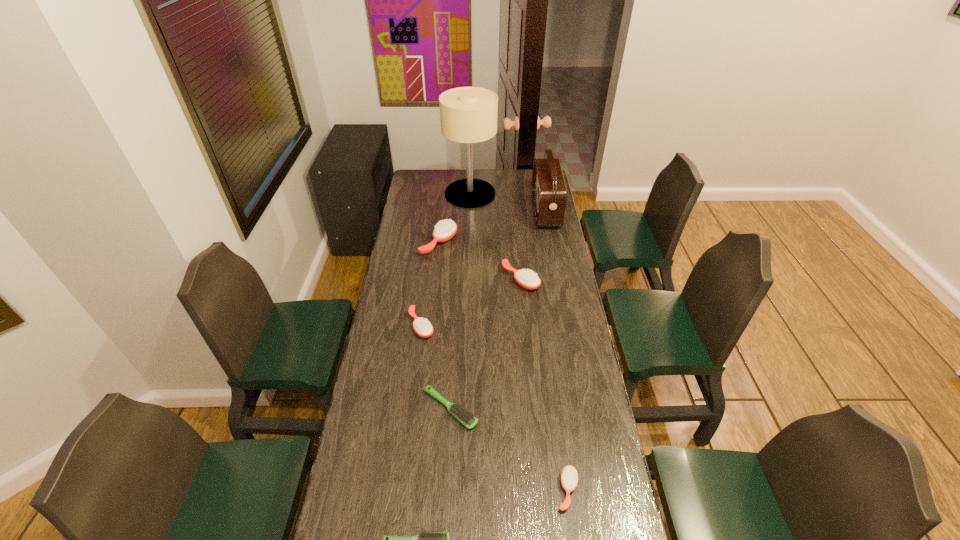
Select which light hairbrush is the second closest to the seventh shortest object. Please provide its 2D coordinates. Your answer should be formatted as a tuple, i.e. [(x, y)], where the tuple contains the x and y coordinates of a point satisfying the conditions above.

[(433, 539)]

Locate an element on the screen. the closest light hairbrush to the third nearest orange hairbrush is located at coordinates (461, 414).

You are a GUI agent. You are given a task and a screenshot of the screen. Output one action in this format:
    pyautogui.click(x=<x>, y=<y>)
    Task: Click on the vacant area in the image that satisfies the following two spatial constraints: 1. on the back side of the biggest orange hairbrush; 2. on the left side of the fourth shortest hairbrush
    
    Given the screenshot: What is the action you would take?
    pyautogui.click(x=432, y=242)

This screenshot has height=540, width=960. What are the coordinates of `vacant point that satisfies the following two spatial constraints: 1. on the back side of the fourth shortest object; 2. on the right side of the beige table lamp` in the screenshot? It's located at click(x=438, y=194).